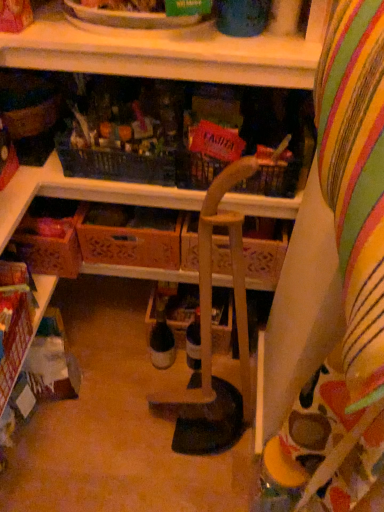
Find the location of a particular element. Image resolution: width=384 pixels, height=512 pixels. free space to the left of wooden chair at center is located at coordinates (130, 431).